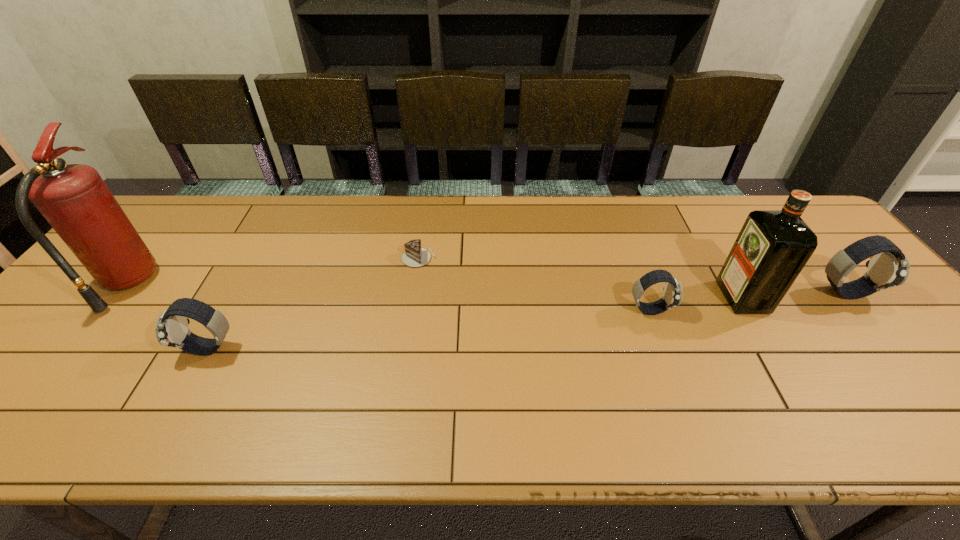
This screenshot has height=540, width=960. What are the coordinates of `watch that stands as the closest to the fifth tallest object` in the screenshot? It's located at (888, 267).